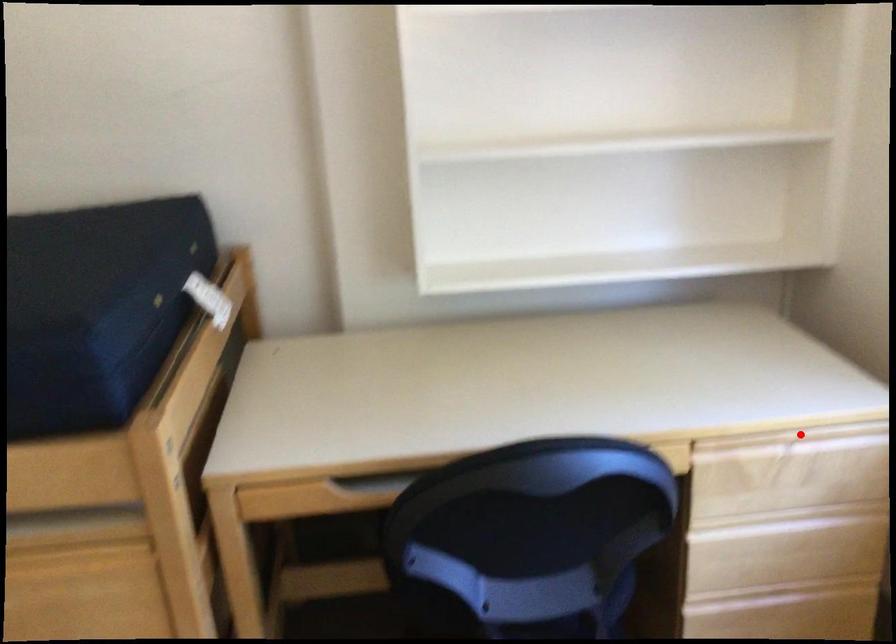
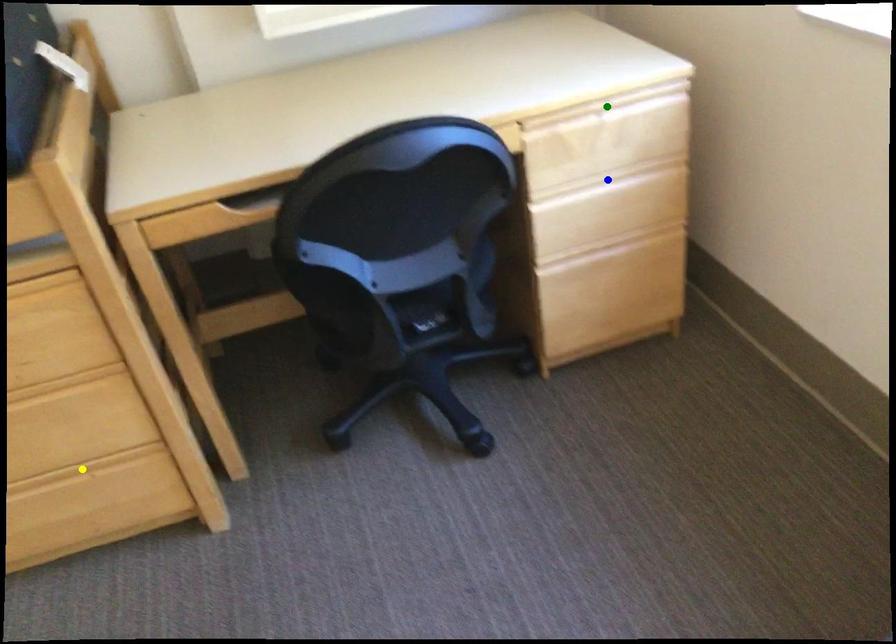
Question: I am providing you with two images of the same scene from different viewpoints. A red point is marked on the first image. You are given multiple points on the second image. Which mark in image 2 goes with the point in image 1?

Choices:
 (A) blue point
 (B) yellow point
 (C) green point

Answer: (C)